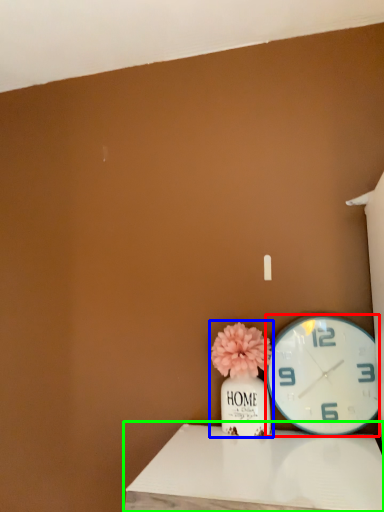
Question: Considering the real-world distances, which object is closest to wall clock (highlighted by a red box)? floral arrangement (highlighted by a blue box) or table (highlighted by a green box).

Choices:
 (A) floral arrangement
 (B) table

Answer: (A)